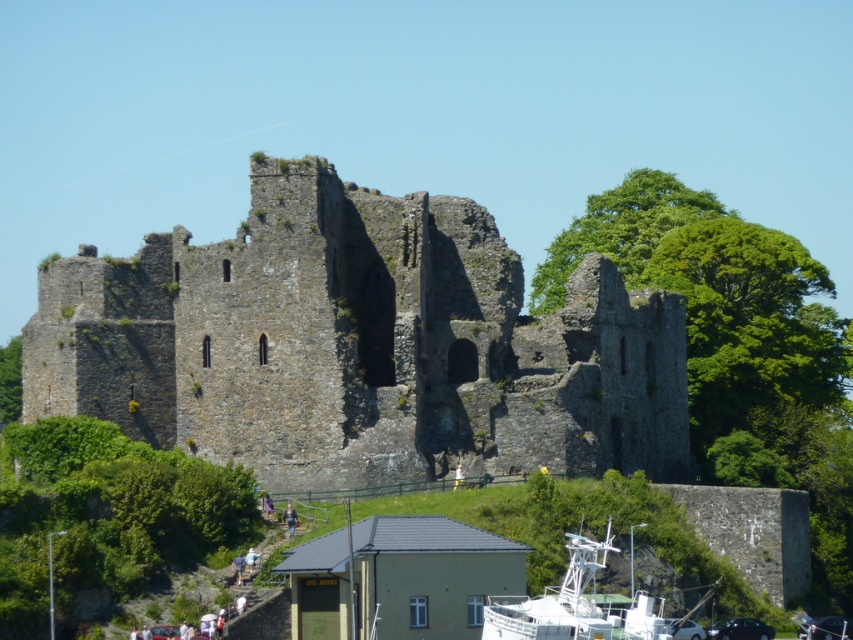
You are planning a hiking trip and want to know if you can see the white plastic boat at lower right from the rough stone castle at center. Based on the scene description, can you see it?

The rough stone castle at center is above the white plastic boat at lower right, so yes, you can see the white plastic boat at lower right from the rough stone castle at center because it is positioned lower and within the line of sight.

You are a hiker who wants to take a photo of the rough stone castle at center without any obstructions. Is the white plastic boat at lower right blocking your view of the castle?

The white plastic boat at lower right is behind the rough stone castle at center, so it does not block the view of the castle.

You are standing at the camera position and want to reach point (57, 372). Given that your walking speed is 3 feet per second, how many seconds will it take you to walk directly to that point?

The distance between the camera and point (57, 372) is 356.98 feet. At a speed of 3 feet per second, it would take approximately 118.99 seconds to reach the point.